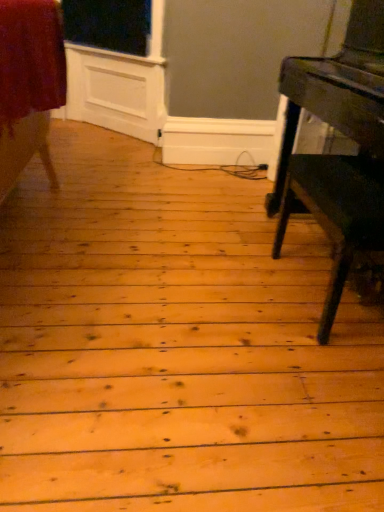
Measure the distance between shiny dark wood table at right and camera.

shiny dark wood table at right and camera are 6.62 feet apart.

I want to click on shiny dark wood table at right, so click(337, 155).

The width and height of the screenshot is (384, 512). What do you see at coordinates (337, 155) in the screenshot? I see `shiny dark wood table at right` at bounding box center [337, 155].

What do you see at coordinates (29, 84) in the screenshot?
I see `velvet red skirt at left` at bounding box center [29, 84].

The width and height of the screenshot is (384, 512). Identify the location of velvet red skirt at left. (29, 84).

In order to face velvet red skirt at left, should I rotate leftwards or rightwards?

Rotate your view left by about 19.732°.

The width and height of the screenshot is (384, 512). I want to click on shiny dark wood table at right, so click(x=337, y=155).

Consider the image. Can you confirm if shiny dark wood table at right is positioned to the right of velvet red skirt at left?

Indeed, shiny dark wood table at right is positioned on the right side of velvet red skirt at left.

Is the position of shiny dark wood table at right less distant than that of velvet red skirt at left?

That is True.

Is point (304, 106) more distant than point (40, 149)?

Yes, point (304, 106) is behind point (40, 149).

From the image's perspective, does shiny dark wood table at right appear lower than velvet red skirt at left?

Indeed, from the image's perspective, shiny dark wood table at right is shown beneath velvet red skirt at left.

From a real-world perspective, which object stands above the other?

From a 3D spatial view, shiny dark wood table at right is above.

Which object is thinner, shiny dark wood table at right or velvet red skirt at left?

velvet red skirt at left is thinner.

Consider the image. Considering the sizes of shiny dark wood table at right and velvet red skirt at left in the image, is shiny dark wood table at right taller or shorter than velvet red skirt at left?

In the image, shiny dark wood table at right appears to be taller than velvet red skirt at left.

Is shiny dark wood table at right smaller than velvet red skirt at left?

No, shiny dark wood table at right is not smaller than velvet red skirt at left.

Is shiny dark wood table at right inside the boundaries of velvet red skirt at left, or outside?

shiny dark wood table at right is outside velvet red skirt at left.

Based on the photo, is shiny dark wood table at right far from velvet red skirt at left?

Yes, shiny dark wood table at right is far from velvet red skirt at left.

Is shiny dark wood table at right facing towards velvet red skirt at left?

Yes, shiny dark wood table at right is facing velvet red skirt at left.

How different are the orientations of shiny dark wood table at right and velvet red skirt at left in degrees?

There is a 1.51-degree angle between the facing directions of shiny dark wood table at right and velvet red skirt at left.

Locate an element on the screen. This screenshot has height=512, width=384. table in front of the velvet red skirt at left is located at coordinates (337, 155).

Considering the relative positions of velvet red skirt at left and shiny dark wood table at right in the image provided, is velvet red skirt at left to the right of shiny dark wood table at right from the viewer's perspective?

Incorrect, velvet red skirt at left is not on the right side of shiny dark wood table at right.

Considering their positions, is velvet red skirt at left located in front of or behind shiny dark wood table at right?

velvet red skirt at left is positioned farther from the viewer than shiny dark wood table at right.

Is point (45, 128) positioned in front of point (382, 203)?

No, it is behind (382, 203).

Consider the image. From the image's perspective, is velvet red skirt at left on shiny dark wood table at right?

Yes, from the image's perspective, velvet red skirt at left is on top of shiny dark wood table at right.

From a real-world perspective, does velvet red skirt at left stand above shiny dark wood table at right?

No, from a real-world perspective, velvet red skirt at left is not on top of shiny dark wood table at right.

Looking at their sizes, would you say velvet red skirt at left is wider or thinner than shiny dark wood table at right?

Clearly, velvet red skirt at left has less width compared to shiny dark wood table at right.

Considering the relative sizes of velvet red skirt at left and shiny dark wood table at right in the image provided, is velvet red skirt at left shorter than shiny dark wood table at right?

Yes, velvet red skirt at left is shorter than shiny dark wood table at right.

Is velvet red skirt at left smaller than shiny dark wood table at right?

Correct, velvet red skirt at left occupies less space than shiny dark wood table at right.

Can shiny dark wood table at right be found inside velvet red skirt at left?

Definitely not — shiny dark wood table at right is not inside velvet red skirt at left.

Is velvet red skirt at left far away from shiny dark wood table at right?

Indeed, velvet red skirt at left is not near shiny dark wood table at right.

Is velvet red skirt at left aimed at shiny dark wood table at right?

No, velvet red skirt at left is not oriented towards shiny dark wood table at right.

The width and height of the screenshot is (384, 512). Identify the location of furniture on the left of shiny dark wood table at right. (29, 84).

Locate an element on the screen. The height and width of the screenshot is (512, 384). furniture on the left of shiny dark wood table at right is located at coordinates (29, 84).

The image size is (384, 512). Identify the location of table below the velvet red skirt at left (from the image's perspective). (337, 155).